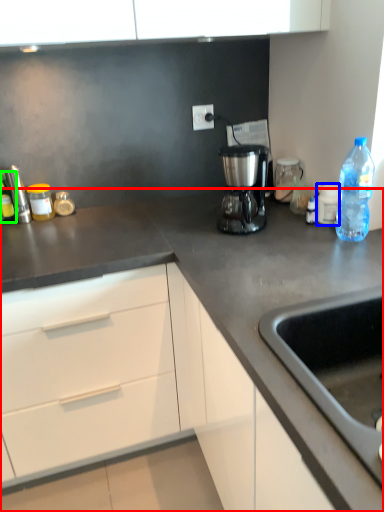
Question: Based on their relative distances, which object is nearer to countertop (highlighted by a red box)? Choose from appliance (highlighted by a blue box) and bottle (highlighted by a green box).

Choices:
 (A) appliance
 (B) bottle

Answer: (A)